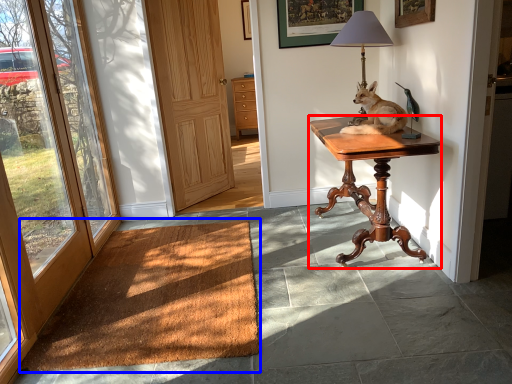
Question: Which object appears farthest to the camera in this image, desk (highlighted by a red box) or doormat (highlighted by a blue box)?

Choices:
 (A) desk
 (B) doormat

Answer: (A)